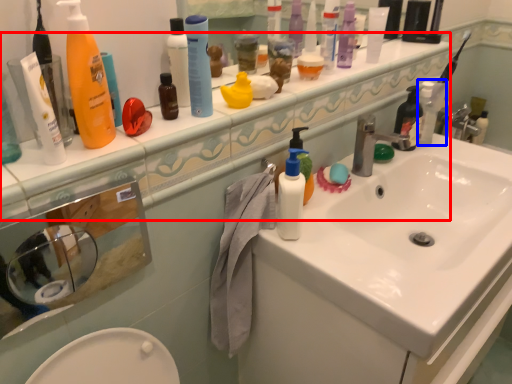
Question: Among these objects, which one is farthest to the camera, counter top (highlighted by a red box) or cleaning product (highlighted by a blue box)?

Choices:
 (A) counter top
 (B) cleaning product

Answer: (B)